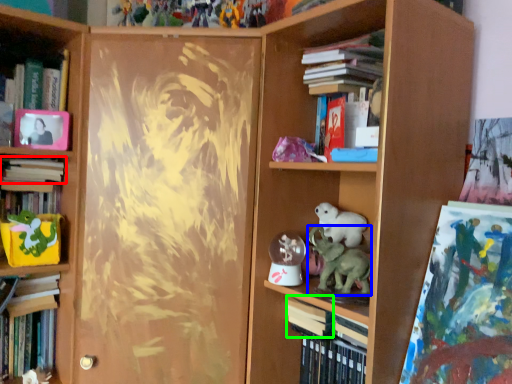
Question: Based on their relative distances, which object is farther from book (highlighted by a red box)? Choose from animal (highlighted by a blue box) and paperback book (highlighted by a green box).

Choices:
 (A) animal
 (B) paperback book

Answer: (A)